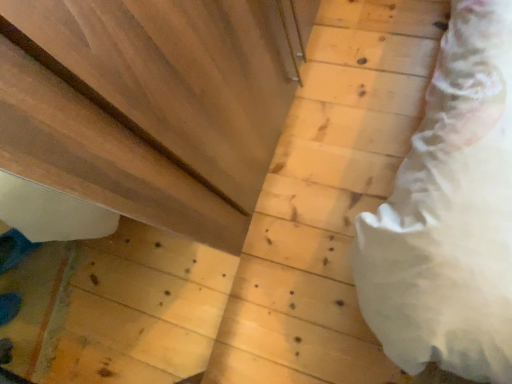
At what (x,y) coordinates should I click in order to perform the action: click on light wood stairwell at center. Please return your answer as a coordinate pair (x, y). Image resolution: width=512 pixels, height=384 pixels. Looking at the image, I should click on (328, 199).

What do you see at coordinates (328, 199) in the screenshot? This screenshot has width=512, height=384. I see `light wood stairwell at center` at bounding box center [328, 199].

The width and height of the screenshot is (512, 384). I want to click on light wood stairwell at center, so click(x=328, y=199).